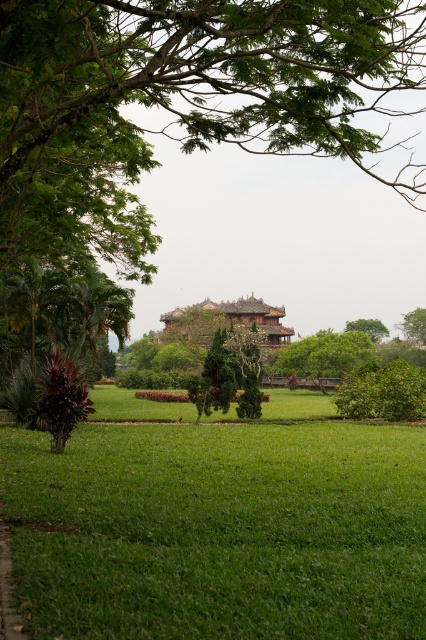
Question: Which point is farther to the camera?

Choices:
 (A) (420, 317)
 (B) (360, 332)
 (C) (365, 321)
 (D) (198, 305)

Answer: (C)

Question: Does brown wooden palace at center have a lesser width compared to green leafy tree at upper center?

Choices:
 (A) yes
 (B) no

Answer: (B)

Question: Does green leafy tree at center appear under green leafy tree at upper right?

Choices:
 (A) no
 (B) yes

Answer: (B)

Question: Which of the following is the closest to the observer?

Choices:
 (A) (316, 352)
 (B) (196, 397)
 (C) (411, 330)

Answer: (B)

Question: Is green leafy tree at center closer to camera compared to green textured tree at center?

Choices:
 (A) no
 (B) yes

Answer: (A)

Question: Which object is the farthest from the green textured tree at center?

Choices:
 (A) brown wooden palace at center
 (B) green leafy tree at upper center
 (C) green leafy tree at center
 (D) green leafy tree at upper right

Answer: (B)